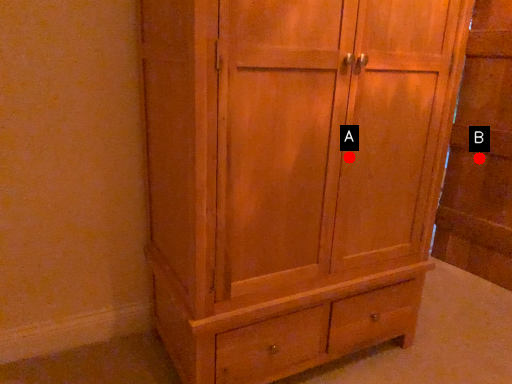
Question: Two points are circled on the image, labeled by A and B beside each circle. Among these points, which one is farthest from the camera?

Choices:
 (A) A is further
 (B) B is further

Answer: (B)